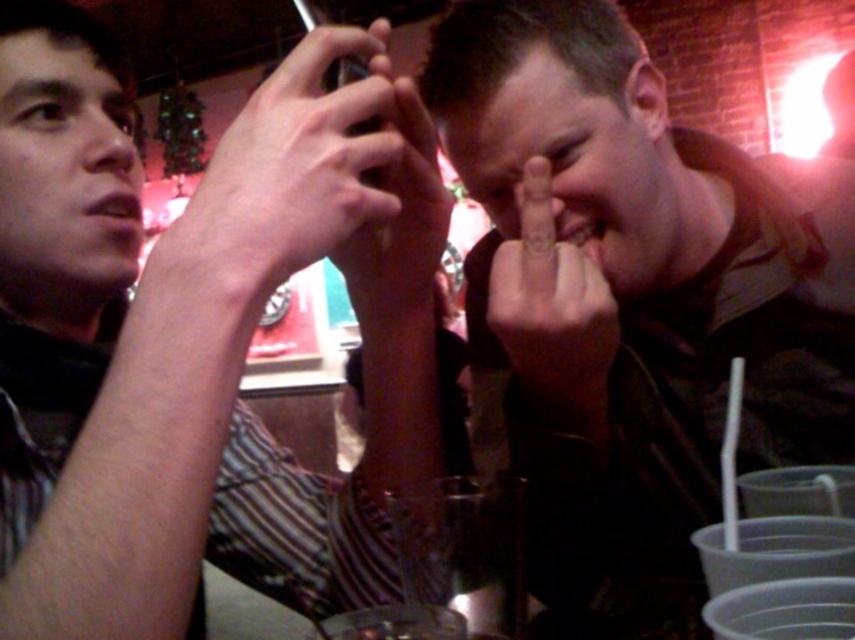
Question: Which object appears farthest from the camera in this image?

Choices:
 (A) dark brown leather jacket at center
 (B) matte black phone at center
 (C) matte skin nose at upper left
 (D) matte black phone at upper center

Answer: (C)

Question: Which object appears closest to the camera in this image?

Choices:
 (A) dark brown leather jacket at center
 (B) matte black phone at upper left

Answer: (B)

Question: Does matte black phone at upper left have a smaller size compared to matte black phone at upper center?

Choices:
 (A) yes
 (B) no

Answer: (B)

Question: Can you confirm if matte black phone at upper left is positioned to the left of smooth skin hand at center?

Choices:
 (A) no
 (B) yes

Answer: (B)

Question: Can you confirm if matte black phone at upper center is thinner than smooth skin hand at center?

Choices:
 (A) yes
 (B) no

Answer: (B)

Question: Which point is farther to the camera?

Choices:
 (A) matte skin nose at upper left
 (B) matte black phone at upper center
 (C) matte black phone at center
 (D) smooth skin hand at center

Answer: (A)